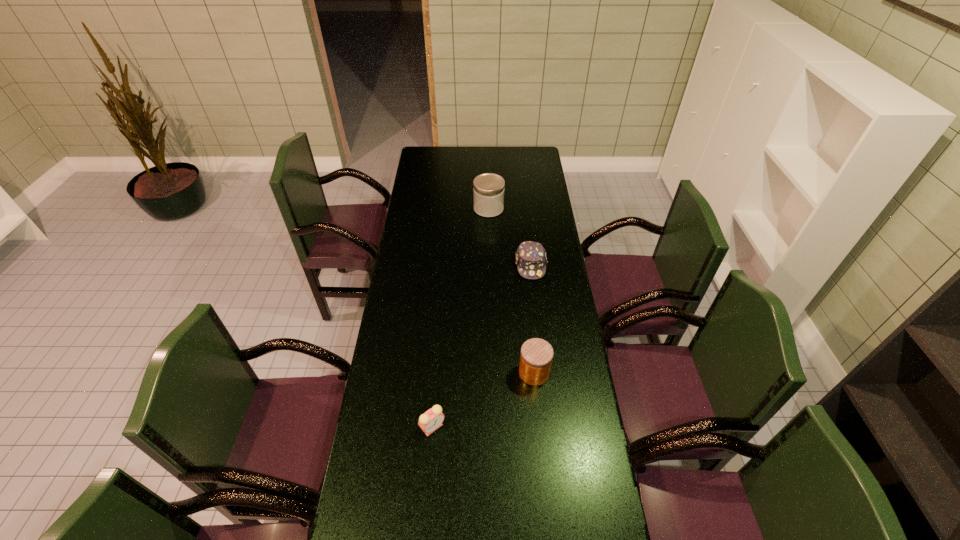
Identify the location of vacant point located 0.350m on the front-facing side of the headwear. Image resolution: width=960 pixels, height=540 pixels. (540, 349).

This screenshot has width=960, height=540. I want to click on jar present at the right edge, so click(x=536, y=356).

In order to click on headwear located in the right edge section of the desktop in this screenshot , I will do `click(531, 260)`.

Locate an element on the screen. The height and width of the screenshot is (540, 960). vacant area at the far edge is located at coordinates (461, 146).

You are a GUI agent. You are given a task and a screenshot of the screen. Output one action in this format:
    pyautogui.click(x=<x>, y=<y>)
    Task: Click on the free space at the left edge of the desktop
    The height and width of the screenshot is (540, 960).
    Given the screenshot: What is the action you would take?
    pyautogui.click(x=432, y=262)

Identify the location of vacant space at the right edge of the desktop. This screenshot has height=540, width=960. (561, 253).

You are a GUI agent. You are given a task and a screenshot of the screen. Output one action in this format:
    pyautogui.click(x=<x>, y=<y>)
    Task: Click on the vacant space at the far left corner of the desktop
    The height and width of the screenshot is (540, 960).
    Given the screenshot: What is the action you would take?
    pyautogui.click(x=425, y=147)

The image size is (960, 540). I want to click on free space between the farther jar and the nearest object, so [461, 318].

Identify the location of vacant space in between the third farthest object and the nearest object. The height and width of the screenshot is (540, 960). (x=483, y=400).

Identify the location of blank region between the second farthest object and the farthest object. Image resolution: width=960 pixels, height=540 pixels. (510, 237).